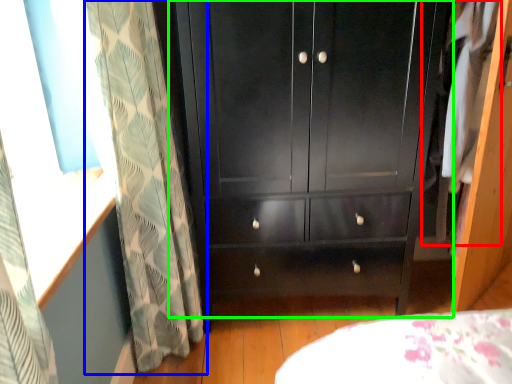
Question: Based on their relative distances, which object is nearer to clothing (highlighted by a red box)? Choose from curtain (highlighted by a blue box) and cupboard (highlighted by a green box).

Choices:
 (A) curtain
 (B) cupboard

Answer: (B)